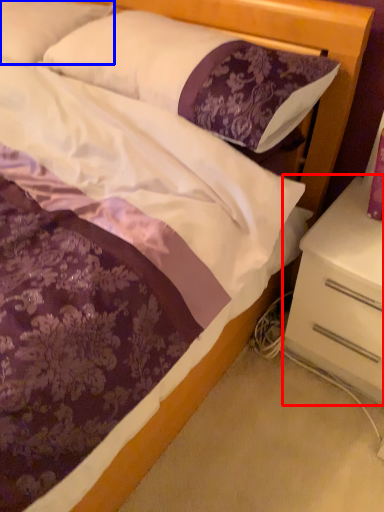
Question: Which object appears closest to the camera in this image, nightstand (highlighted by a red box) or pillow (highlighted by a blue box)?

Choices:
 (A) nightstand
 (B) pillow

Answer: (A)